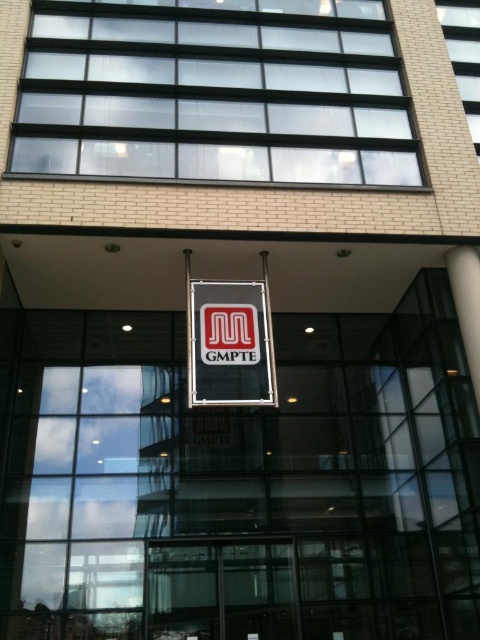
Is point (236, 339) closer to camera compared to point (471, 376)?

No, (236, 339) is behind (471, 376).

Where is `matte black sign at center`? matte black sign at center is located at coordinates (229, 344).